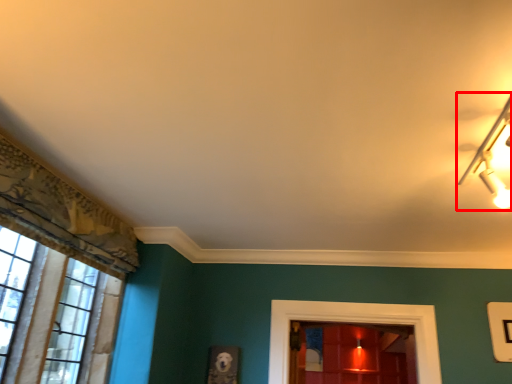
Question: From the image's perspective, what is the correct spatial relationship of lamp (annotated by the red box) in relation to window?

Choices:
 (A) above
 (B) below

Answer: (A)